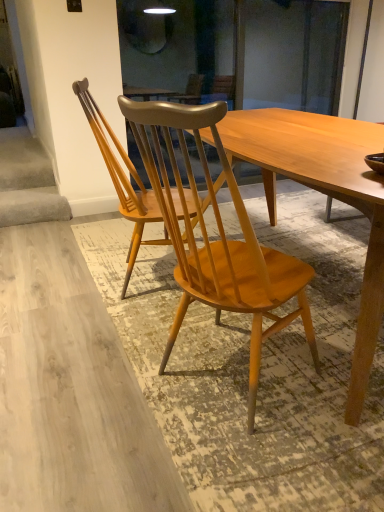
At what (x,y) coordinates should I click in order to perform the action: click on free location in front of natural wood chair at center, arranged as the second chair when viewed from the back. Please return your answer as a coordinate pair (x, y). The width and height of the screenshot is (384, 512). Looking at the image, I should click on (268, 466).